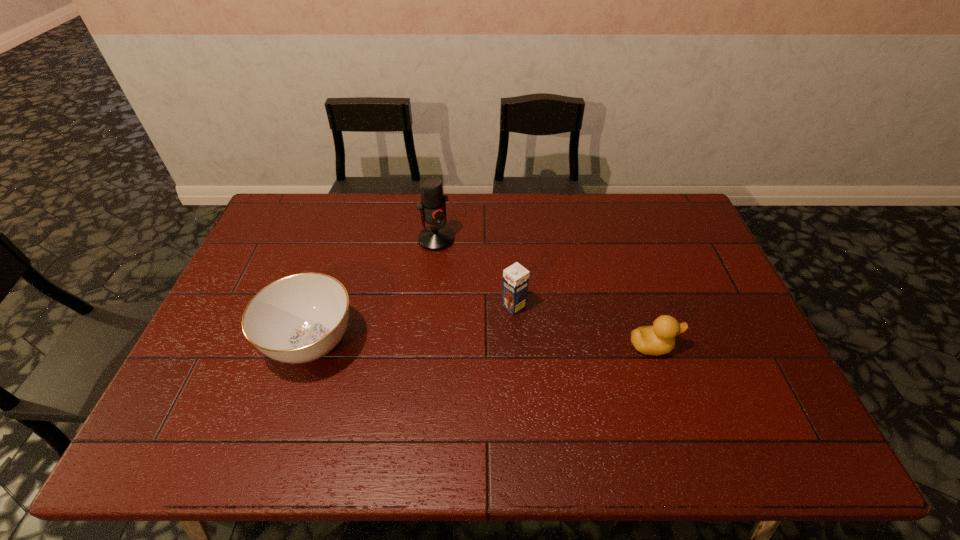
Where is `vacant space at the right edge of the desktop`? This screenshot has width=960, height=540. vacant space at the right edge of the desktop is located at coordinates (694, 296).

Identify the location of vacant space at the near left corner. The image size is (960, 540). (185, 400).

The image size is (960, 540). Find the location of `vacant space at the far right corner of the desktop`. vacant space at the far right corner of the desktop is located at coordinates (658, 217).

The width and height of the screenshot is (960, 540). What are the coordinates of `free space between the shortest object and the tallest object` in the screenshot? It's located at (544, 293).

I want to click on empty location between the third object from right to left and the rightmost object, so click(544, 293).

Find the location of a particular element. The image size is (960, 540). vacant area between the duckling and the leftmost object is located at coordinates (482, 345).

Find the location of a particular element. The image size is (960, 540). free point between the chocolate milk and the duckling is located at coordinates [x=583, y=326].

Identify the location of vacant space in between the chocolate milk and the tallest object. coord(475,273).

Where is `empty space between the leftmost object and the second object from right to left`? The height and width of the screenshot is (540, 960). empty space between the leftmost object and the second object from right to left is located at coordinates (413, 324).

You are a GUI agent. You are given a task and a screenshot of the screen. Output one action in this format:
    pyautogui.click(x=<x>, y=<y>)
    Task: Click on the free space between the second object from right to left and the duckling
    This screenshot has height=540, width=960.
    Given the screenshot: What is the action you would take?
    pyautogui.click(x=583, y=326)